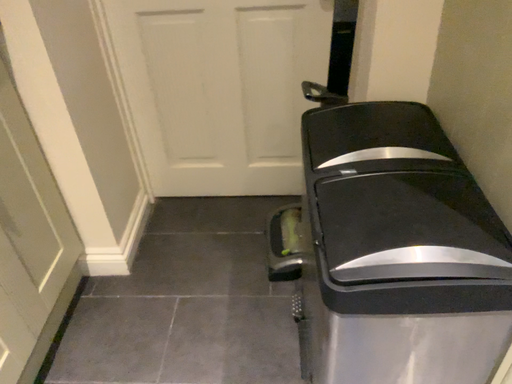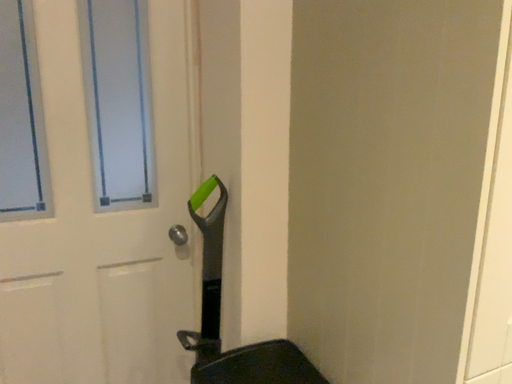
Question: Which way did the camera rotate in the video?

Choices:
 (A) rotated right
 (B) rotated left

Answer: (A)